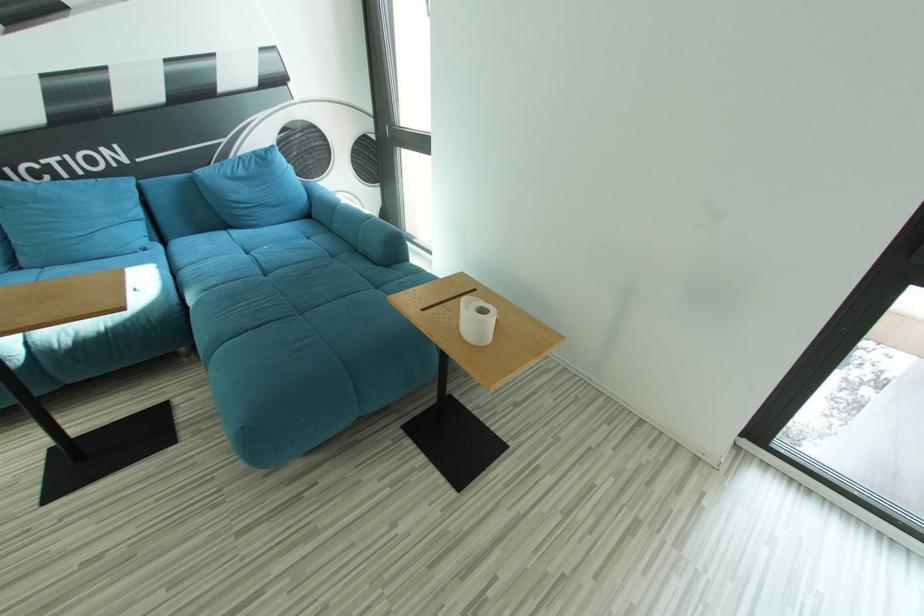
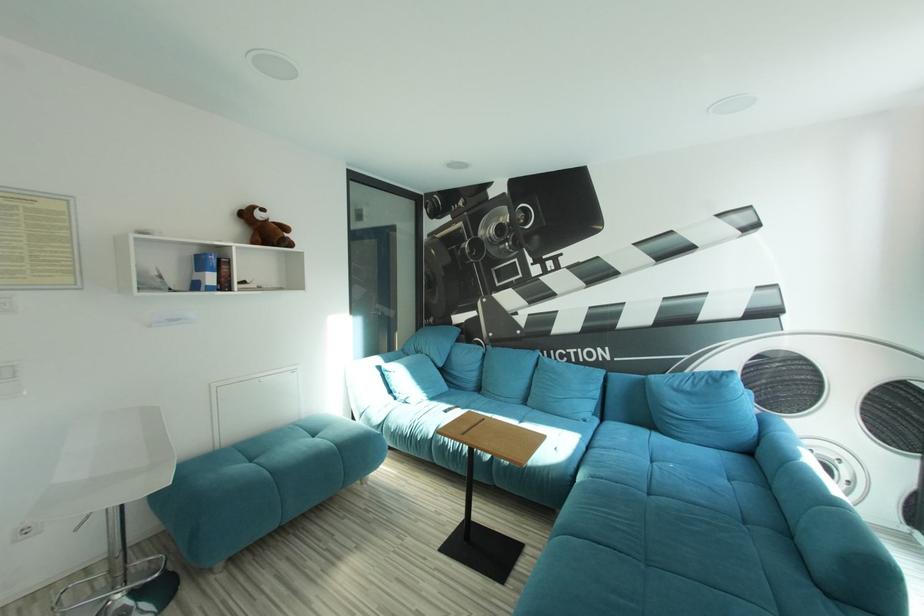
Question: The images are taken continuously from a first-person perspective. In which direction is your viewpoint rotating?

Choices:
 (A) Left
 (B) Right
 (C) Up
 (D) Down

Answer: (A)